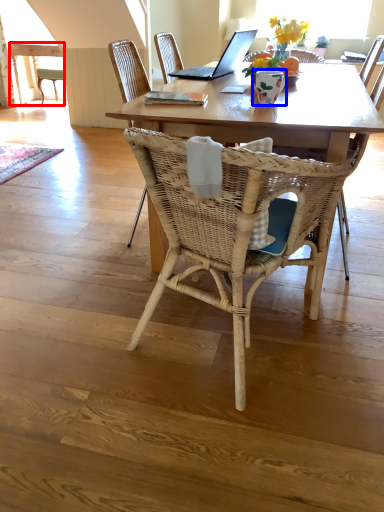
Question: Which object appears closest to the camera in this image, table (highlighted by a red box) or vase (highlighted by a blue box)?

Choices:
 (A) table
 (B) vase

Answer: (B)